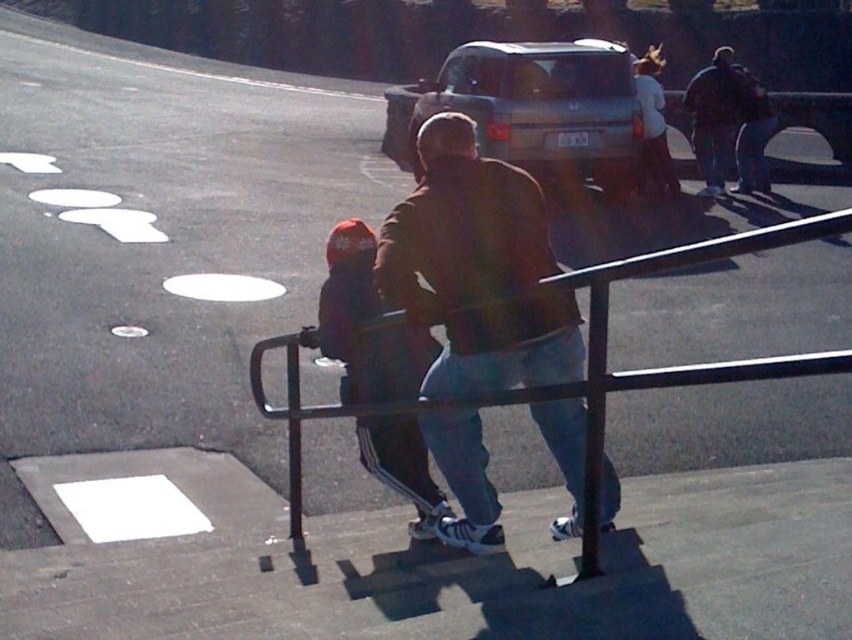
Who is positioned more to the right, black metal railing at center or dark brown jacket at upper right?

dark brown jacket at upper right

Does point (729, 380) come farther from viewer compared to point (735, 109)?

No, (729, 380) is in front of (735, 109).

Locate an element on the screen. Image resolution: width=852 pixels, height=640 pixels. black metal railing at center is located at coordinates (586, 358).

Is dark blue fabric jacket at center wider than dark brown jacket at upper right?

No.

Can you confirm if dark blue fabric jacket at center is thinner than dark brown jacket at upper right?

Correct, dark blue fabric jacket at center's width is less than dark brown jacket at upper right's.

The image size is (852, 640). In order to click on dark blue fabric jacket at center in this screenshot , I will do `click(363, 320)`.

The width and height of the screenshot is (852, 640). In order to click on dark blue fabric jacket at center in this screenshot , I will do `click(363, 320)`.

Is silver metallic suv at center to the right of dark blue fabric jacket at center from the viewer's perspective?

Yes, silver metallic suv at center is to the right of dark blue fabric jacket at center.

Between point (540, 140) and point (373, 440), which one is positioned in front?

Point (373, 440) is more forward.

This screenshot has width=852, height=640. Find the location of `silver metallic suv at center`. silver metallic suv at center is located at coordinates (532, 109).